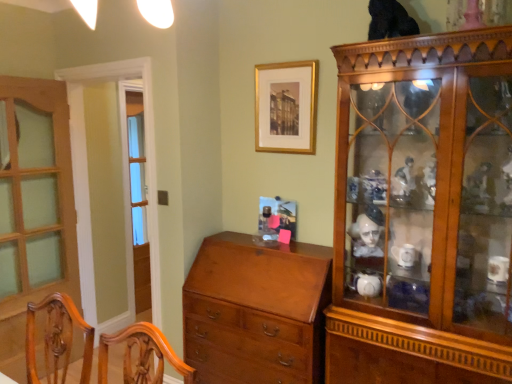
Question: Considering the positions of shiny brown chest of drawers at center and clear glass screen door at left in the image, is shiny brown chest of drawers at center taller or shorter than clear glass screen door at left?

Choices:
 (A) short
 (B) tall

Answer: (A)

Question: Based on their positions, is shiny brown chest of drawers at center located to the left or right of clear glass screen door at left?

Choices:
 (A) left
 (B) right

Answer: (B)

Question: Based on their relative distances, which object is nearer to the black fur cat at upper center?

Choices:
 (A) clear glass screen door at left
 (B) mahogany wood chair at lower left
 (C) shiny brown chest of drawers at center
 (D) wooden door at left
 (E) wooden cabinet at right

Answer: (E)

Question: Which of these objects is positioned farthest from the gold framed picture at upper center?

Choices:
 (A) wooden cabinet at right
 (B) shiny brown chest of drawers at center
 (C) black fur cat at upper center
 (D) clear glass screen door at left
 (E) mahogany wood chair at lower left

Answer: (E)